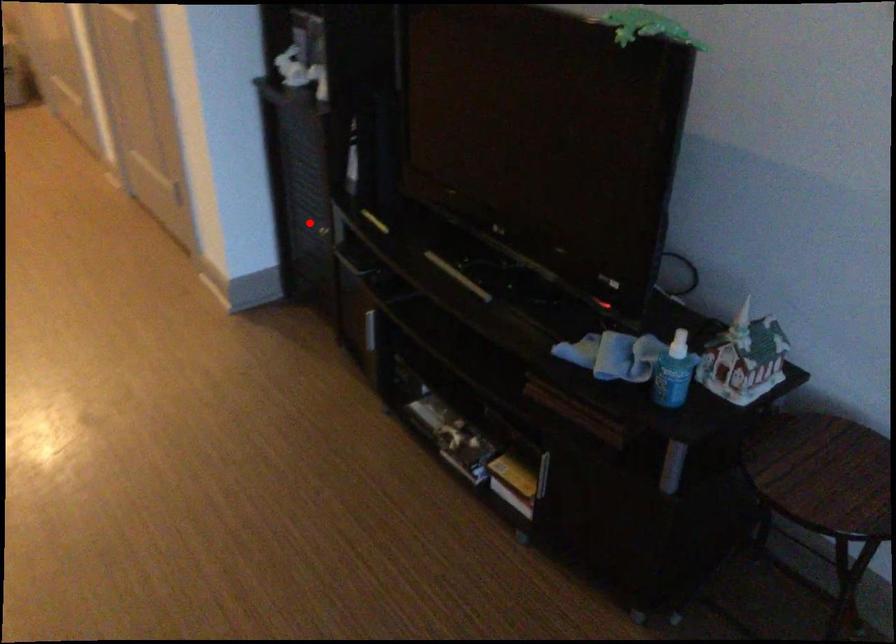
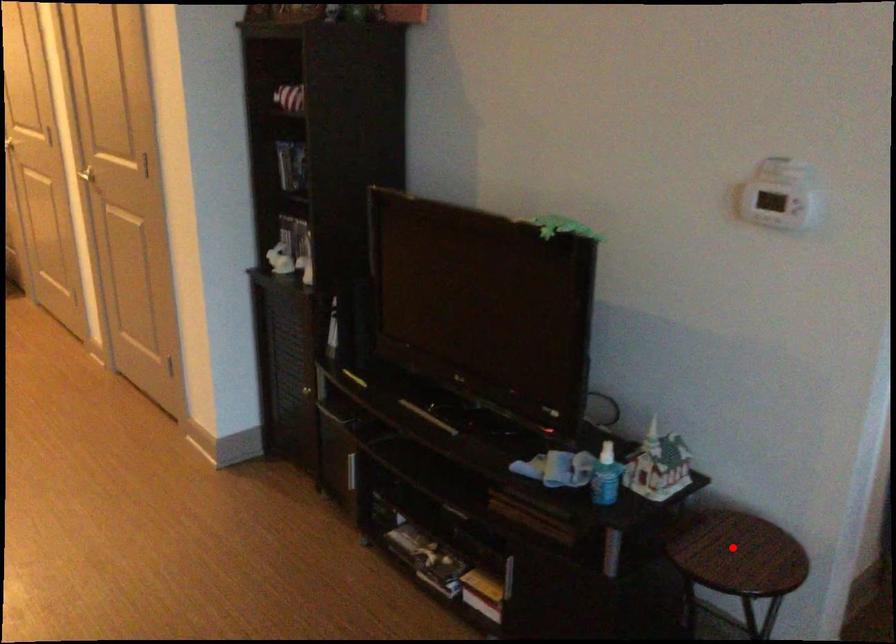
I am providing you with two images of the same scene from different viewpoints. A red point is marked on the first image and another point is marked on the second image. Do the highlighted points in image1 and image2 indicate the same real-world spot?

No